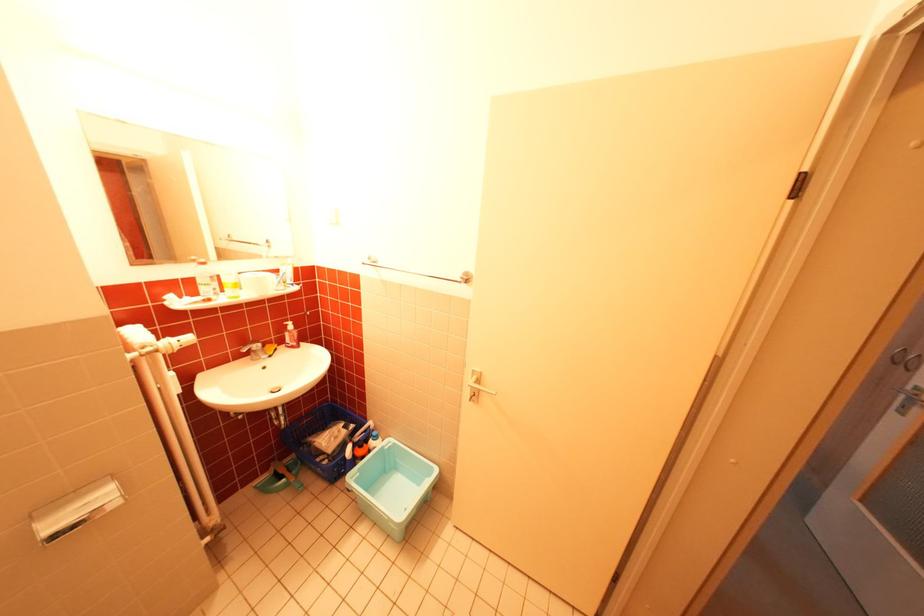
The height and width of the screenshot is (616, 924). Describe the element at coordinates (360, 450) in the screenshot. I see `the orange spray trigger` at that location.